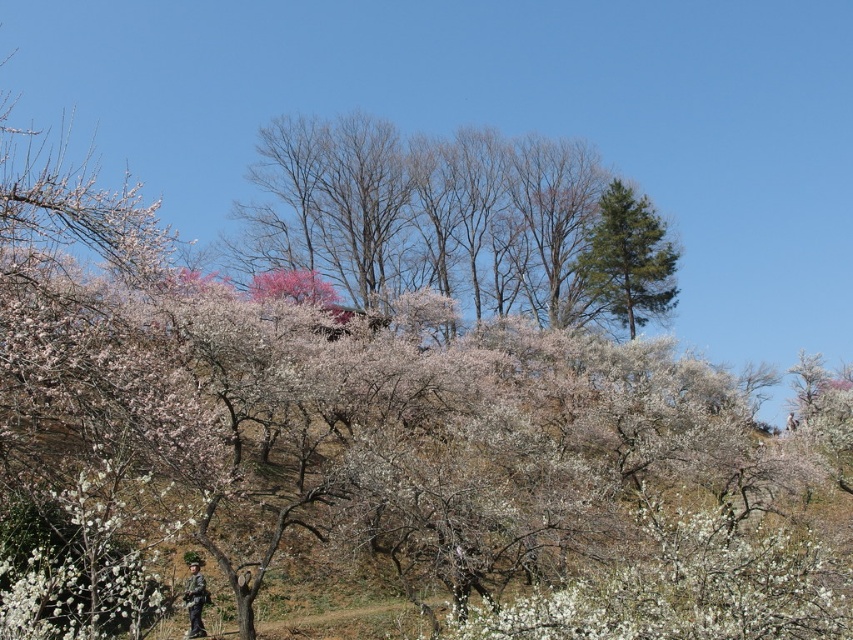
Question: Which of the following is the farthest from the observer?

Choices:
 (A) green needle-like tree at upper center
 (B) bare branches at upper center

Answer: (A)

Question: Can you confirm if bare branches at upper center is thinner than green needle-like tree at upper center?

Choices:
 (A) yes
 (B) no

Answer: (B)

Question: Observing the image, what is the correct spatial positioning of bare branches at upper center in reference to green needle-like tree at upper center?

Choices:
 (A) left
 (B) right

Answer: (A)

Question: From the image, what is the correct spatial relationship of bare branches at upper center in relation to green needle-like tree at upper center?

Choices:
 (A) below
 (B) above

Answer: (A)